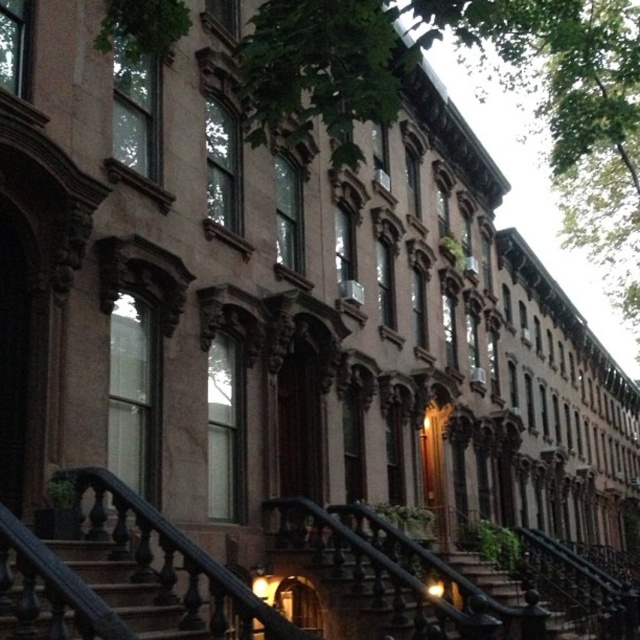
Is dark brown wood stairs at lower left positioned at the back of black wrought iron stairs at center?

No.

Is dark brown wood stairs at lower left taller than black wrought iron stairs at center?

Incorrect, dark brown wood stairs at lower left's height is not larger of black wrought iron stairs at center's.

Who is more distant from viewer, (x=80, y=566) or (x=472, y=576)?

The point (x=472, y=576) is more distant.

Find the location of a particular element. This screenshot has width=640, height=640. dark brown wood stairs at lower left is located at coordinates (124, 589).